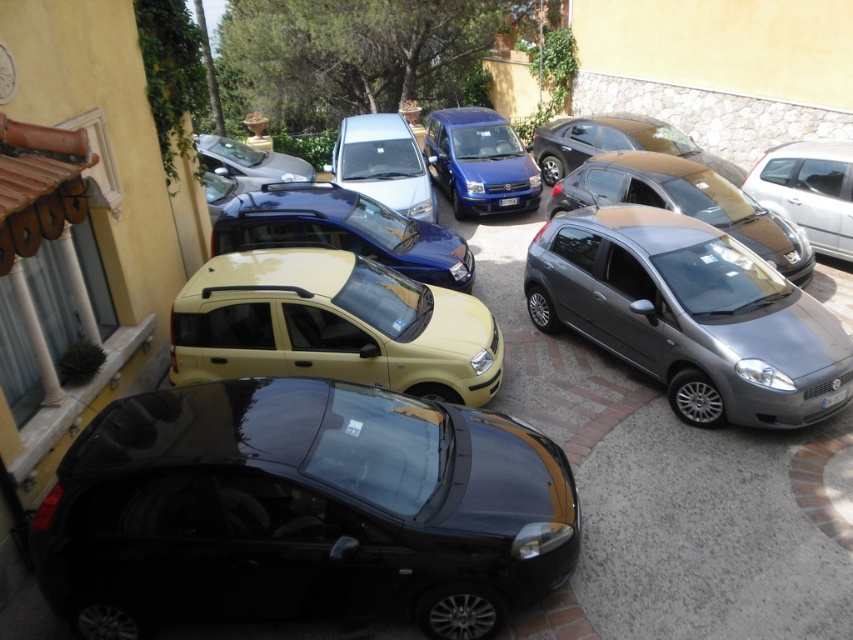
You are a delivery person needing to park your 2.5 meter long van between the glossy blue hatchback at center and the silver metallic hatchback at upper right. Is there enough space for your van?

The distance between the glossy blue hatchback at center and the silver metallic hatchback at upper right is 6.33 meters, which is more than enough to accommodate a 2.5 meter long van.

You are standing at the entrance of the building with the yellow facade and see two points marked in the parking area. The first point is at coordinate point (399, 225) and the second point is at coordinate point (840, 192). If you want to walk from the entrance to the second point, will you pass by the first point along the way?

Point (399, 225) is in front of point (840, 192), so yes, you will pass by the first point on your way to the second point.